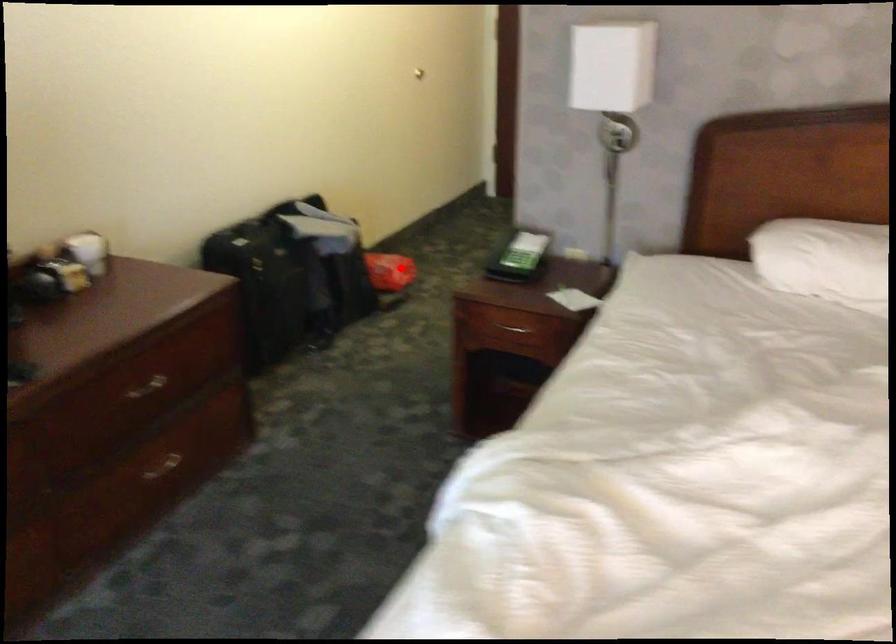
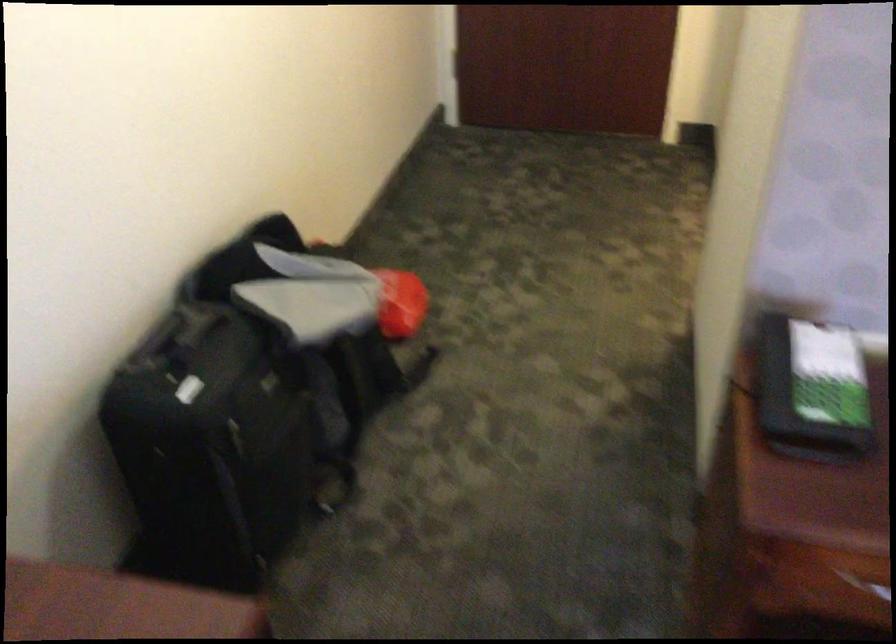
The point at the highlighted location is marked in the first image. Where is the corresponding point in the second image?

(401, 303)